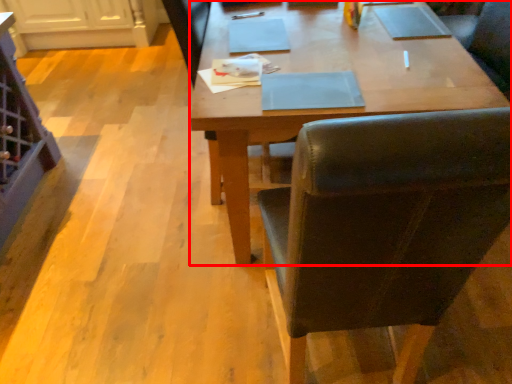
Question: Observing the image, what is the correct spatial positioning of desk (annotated by the red box) in reference to chair?

Choices:
 (A) left
 (B) right

Answer: (B)